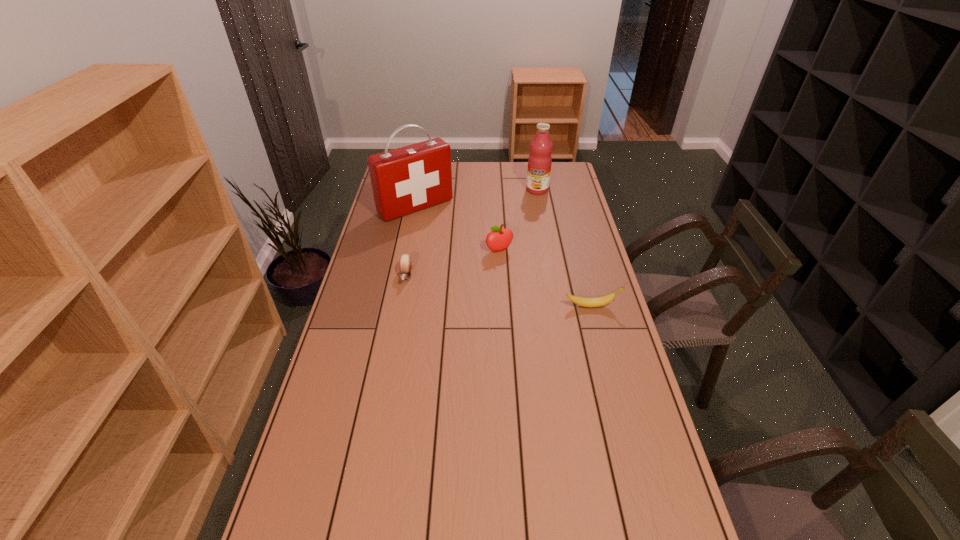
Identify the location of vacant area that lies between the tallest object and the third tallest object. (457, 229).

This screenshot has width=960, height=540. I want to click on vacant space in between the banana and the shortest object, so click(x=499, y=291).

Image resolution: width=960 pixels, height=540 pixels. Find the location of `vacant area between the escargot and the apple`. vacant area between the escargot and the apple is located at coordinates (452, 263).

Find the location of a particular element. The width and height of the screenshot is (960, 540). empty space between the third object from right to left and the shortest object is located at coordinates (452, 263).

This screenshot has height=540, width=960. In order to click on blank region between the tallest object and the escargot in this screenshot , I will do `click(411, 241)`.

In order to click on vacant space that is in between the nearest object and the third object from right to left in this screenshot , I will do `click(545, 278)`.

Find the location of a particular element. vacant space that's between the fourth shortest object and the second shortest object is located at coordinates (564, 248).

Locate an element on the screen. object that stands as the third closest to the fruit juice is located at coordinates (405, 262).

Locate an element on the screen. The height and width of the screenshot is (540, 960). object that is the closest to the third tallest object is located at coordinates (408, 179).

Where is `free point that satisfies the following two spatial constraints: 1. on the front side of the banana; 2. at the stem of the third nearest object`? The image size is (960, 540). free point that satisfies the following two spatial constraints: 1. on the front side of the banana; 2. at the stem of the third nearest object is located at coordinates (502, 306).